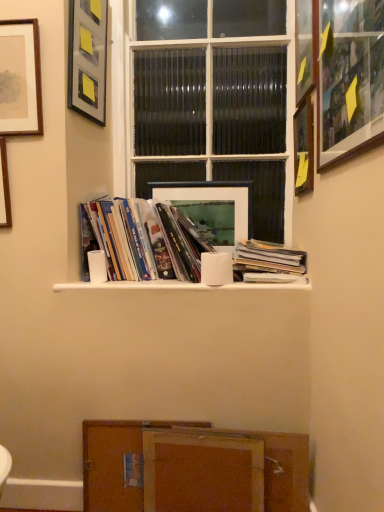
Question: Does wooden cabinet at lower center have a lesser width compared to matte paper stack of books at center, arranged as the 2th book when viewed from the left?

Choices:
 (A) no
 (B) yes

Answer: (B)

Question: Is wooden cabinet at lower center behind matte paper stack of books at center, which is the 1th book in right-to-left order?

Choices:
 (A) yes
 (B) no

Answer: (B)

Question: Can you confirm if wooden cabinet at lower center is wider than matte paper stack of books at center, arranged as the 2th book when viewed from the left?

Choices:
 (A) yes
 (B) no

Answer: (B)

Question: Does wooden cabinet at lower center have a lesser height compared to matte paper stack of books at center, arranged as the 2th book when viewed from the left?

Choices:
 (A) no
 (B) yes

Answer: (A)

Question: From a real-world perspective, is wooden cabinet at lower center located beneath matte paper stack of books at center, arranged as the 2th book when viewed from the left?

Choices:
 (A) yes
 (B) no

Answer: (A)

Question: Is wooden cabinet at lower center positioned before matte paper stack of books at center, arranged as the 2th book when viewed from the left?

Choices:
 (A) no
 (B) yes

Answer: (B)

Question: From the image's perspective, does brown wood cabinet at lower center appear lower than wooden cabinet at lower center?

Choices:
 (A) no
 (B) yes

Answer: (B)

Question: Could wooden cabinet at lower center be considered to be inside brown wood cabinet at lower center?

Choices:
 (A) yes
 (B) no

Answer: (B)

Question: Considering the relative positions of brown wood cabinet at lower center and wooden cabinet at lower center in the image provided, is brown wood cabinet at lower center to the left of wooden cabinet at lower center from the viewer's perspective?

Choices:
 (A) no
 (B) yes

Answer: (B)

Question: Considering the relative sizes of brown wood cabinet at lower center and wooden cabinet at lower center in the image provided, is brown wood cabinet at lower center wider than wooden cabinet at lower center?

Choices:
 (A) yes
 (B) no

Answer: (B)

Question: Would you consider brown wood cabinet at lower center to be distant from wooden cabinet at lower center?

Choices:
 (A) no
 (B) yes

Answer: (A)

Question: Does brown wood cabinet at lower center touch wooden cabinet at lower center?

Choices:
 (A) no
 (B) yes

Answer: (B)

Question: From a real-world perspective, is wooden picture frame at upper right, which appears as the fifth picture frame when viewed from the left, located beneath matte paper stack of books at center, which is the 1th book in right-to-left order?

Choices:
 (A) no
 (B) yes

Answer: (A)